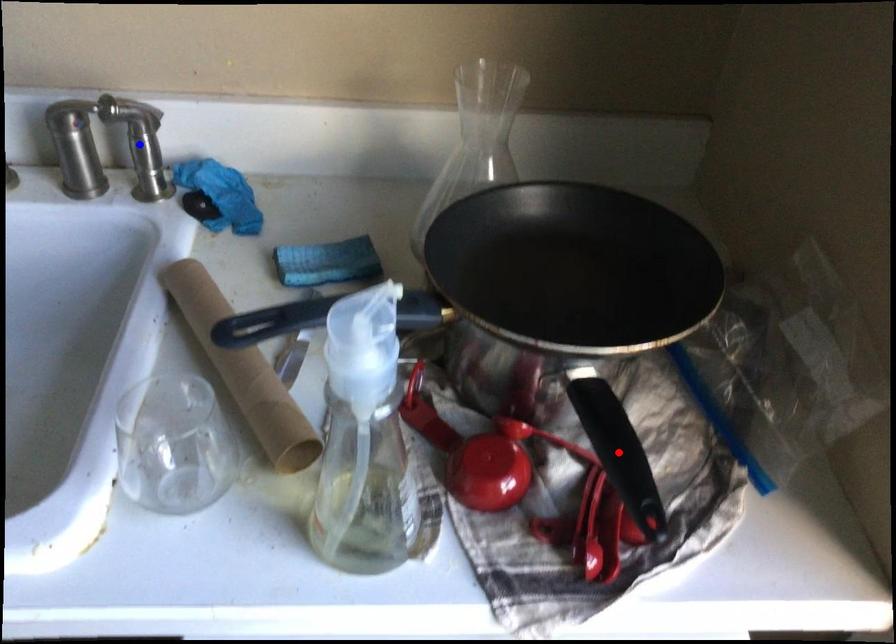
Question: In the image, two points are highlighted. Which point is nearer to the camera? Reply with the corresponding letter.

Choices:
 (A) blue point
 (B) red point

Answer: (B)